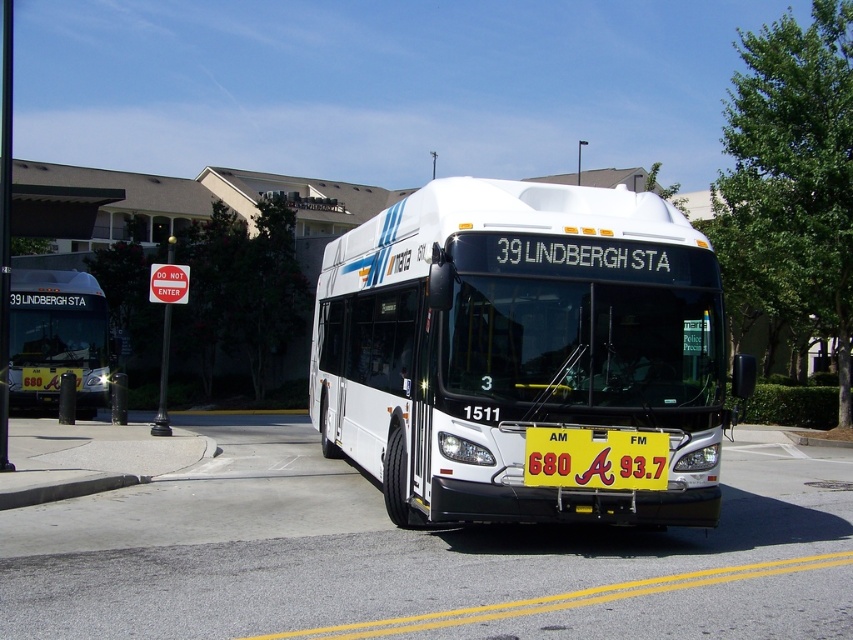
You are a passenger waiting at the bus stop. You see two buses in the image, the white glossy bus at center and the white matte bus at center. Which one is positioned to the right side?

The white glossy bus at center is positioned to the right of the white matte bus at center.

You are a pedestrian standing at the bus stop. There are two buses in front of you, a white glossy bus at center and a white matte bus at center. The bus driver tells you that the distance between them is important for safety. Can you determine if the distance between the two buses is sufficient for a safe stop according to standard regulations which require at least 15 meters between vehicles?

The distance between the white glossy bus at center and the white matte bus at center is 16.48 meters, which exceeds the required 15 meters, so the distance is sufficient for a safe stop.

You are a pedestrian standing at the bus stop. You see the white matte bus at center and the yellow plastic sign at center. How far apart are these two objects?

The distance between the white matte bus at center and the yellow plastic sign at center is 15.29 meters.